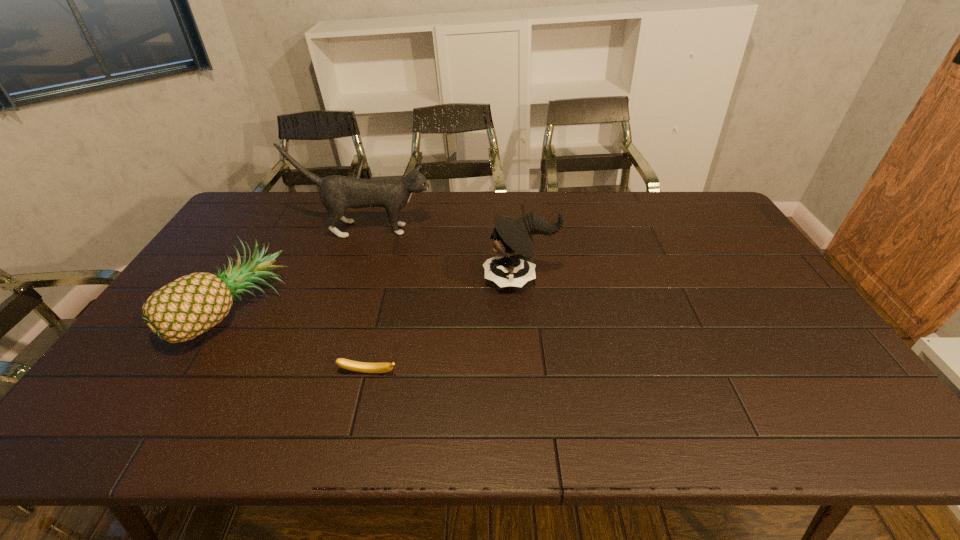
This screenshot has height=540, width=960. I want to click on vacant space that's between the farthest object and the pineapple, so click(300, 271).

You are a GUI agent. You are given a task and a screenshot of the screen. Output one action in this format:
    pyautogui.click(x=<x>, y=<y>)
    Task: Click on the vacant area that lies between the doll and the nearest object
    The height and width of the screenshot is (540, 960).
    Given the screenshot: What is the action you would take?
    pyautogui.click(x=444, y=326)

Identify the location of free spot between the shortest object and the pineapple. (301, 343).

This screenshot has width=960, height=540. I want to click on vacant area that lies between the nearest object and the doll, so click(x=444, y=326).

Identify the location of vacant area that lies between the doll and the banana. (444, 326).

This screenshot has height=540, width=960. Identify the location of unoccupied position between the rightmost object and the farthest object. (443, 254).

Where is `free space between the tallest object and the rightmost object`? The height and width of the screenshot is (540, 960). free space between the tallest object and the rightmost object is located at coordinates (443, 254).

This screenshot has height=540, width=960. Identify the location of free space that is in between the second tallest object and the banana. (444, 326).

This screenshot has width=960, height=540. What are the coordinates of `vacant space that is in between the pineapple and the doll` in the screenshot? It's located at (376, 296).

Locate which object ranks second in proximity to the nearest object. Please provide its 2D coordinates. Your answer should be formatted as a tuple, i.e. [(x, y)], where the tuple contains the x and y coordinates of a point satisfying the conditions above.

[(513, 243)]